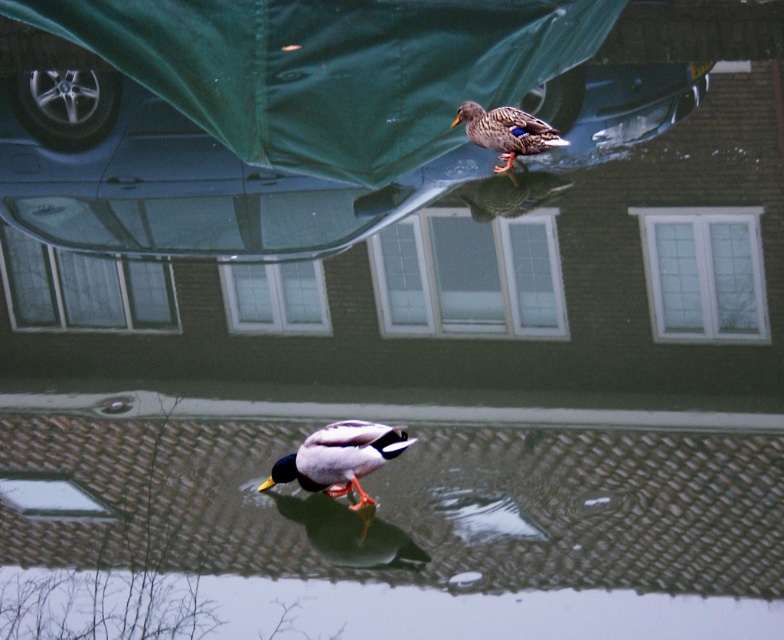
Question: Which point is closer to the camera?

Choices:
 (A) matte brown duck at upper center
 (B) metallic blue car at upper center
 (C) green glossy duck at center

Answer: (C)

Question: Which point appears farthest from the camera in this image?

Choices:
 (A) (463, 58)
 (B) (477, 145)

Answer: (A)

Question: Is the position of metallic blue car at upper center more distant than that of matte brown duck at upper center?

Choices:
 (A) yes
 (B) no

Answer: (A)

Question: In this image, where is metallic blue car at upper center located relative to green glossy duck at center?

Choices:
 (A) below
 (B) above

Answer: (B)

Question: Can you confirm if metallic blue car at upper center is wider than green glossy duck at center?

Choices:
 (A) no
 (B) yes

Answer: (B)

Question: Which of the following is the closest to the observer?

Choices:
 (A) (256, 125)
 (B) (499, 125)
 (C) (294, 465)

Answer: (C)